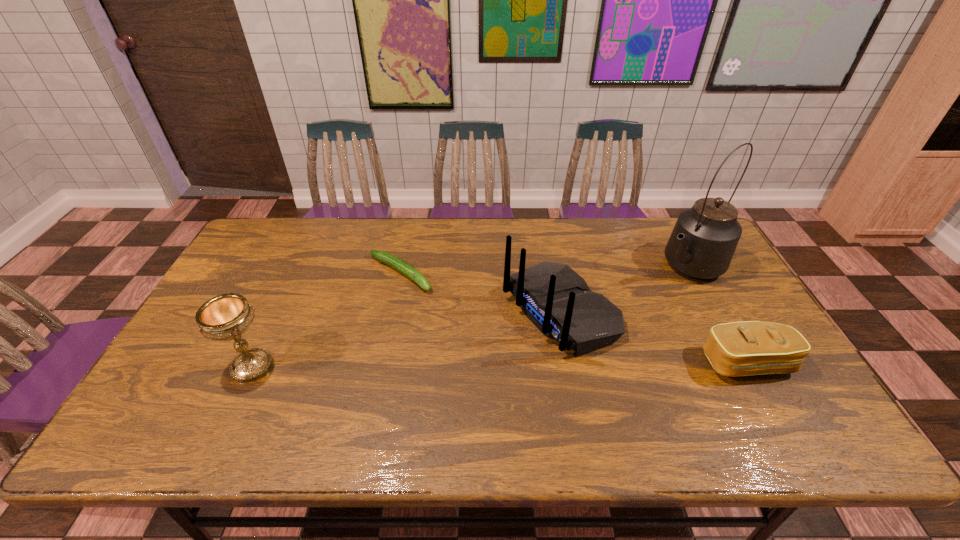
Where is `clutch bag at the near edge`? The image size is (960, 540). clutch bag at the near edge is located at coordinates click(x=746, y=348).

I want to click on object that is at the left edge, so click(226, 317).

Where is `clutch bag located at the right edge`? The image size is (960, 540). clutch bag located at the right edge is located at coordinates (746, 348).

Identify the location of kettle positioned at the right edge. The height and width of the screenshot is (540, 960). tap(704, 239).

This screenshot has height=540, width=960. Find the location of `object located at the near left corner`. object located at the near left corner is located at coordinates (226, 317).

Find the location of a particular element. The image size is (960, 540). object that is at the far right corner is located at coordinates (704, 239).

The image size is (960, 540). I want to click on object located at the near right corner, so click(x=746, y=348).

In the image, there is a desktop. Where is `vacant region at the far edge`? The height and width of the screenshot is (540, 960). vacant region at the far edge is located at coordinates (548, 224).

The height and width of the screenshot is (540, 960). In the image, there is a desktop. Find the location of `vacant space at the near edge`. vacant space at the near edge is located at coordinates (612, 386).

Find the location of a particular element. vacant area at the left edge of the desktop is located at coordinates (207, 350).